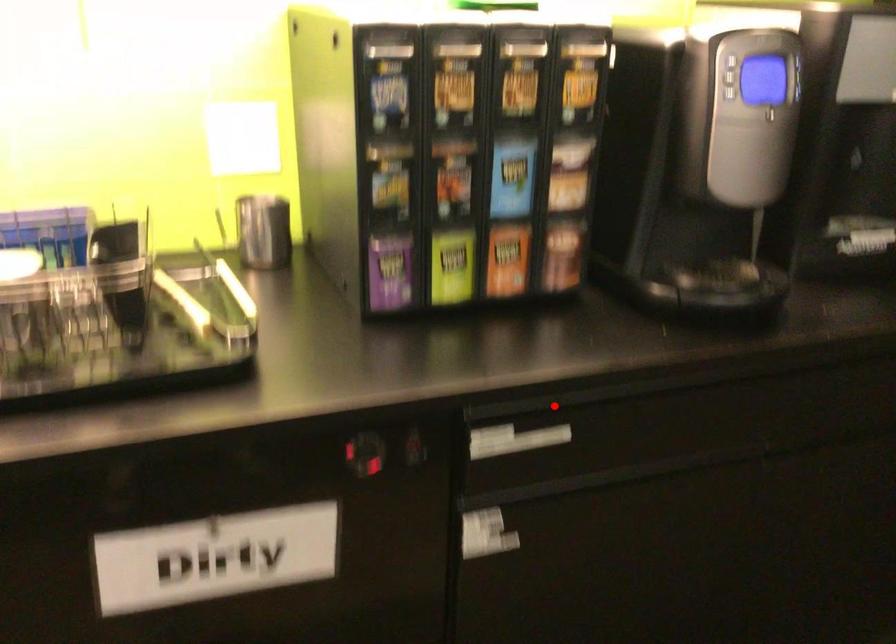
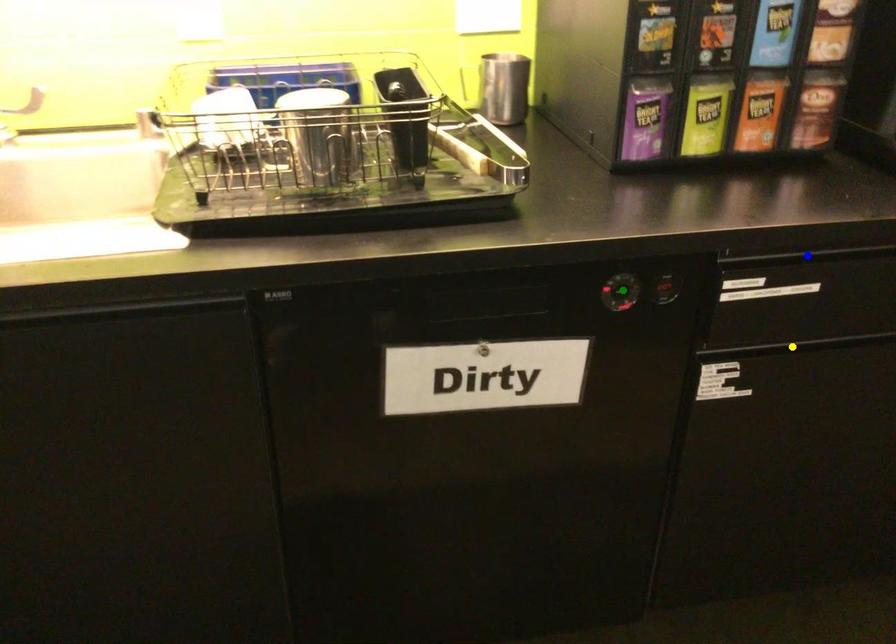
Question: I am providing you with two images of the same scene from different viewpoints. A red point is marked on the first image. You are given multiple points on the second image. Which point in image 2 is actually the same real-world point as the red point in image 1?

Choices:
 (A) yellow point
 (B) blue point
 (C) green point

Answer: (B)